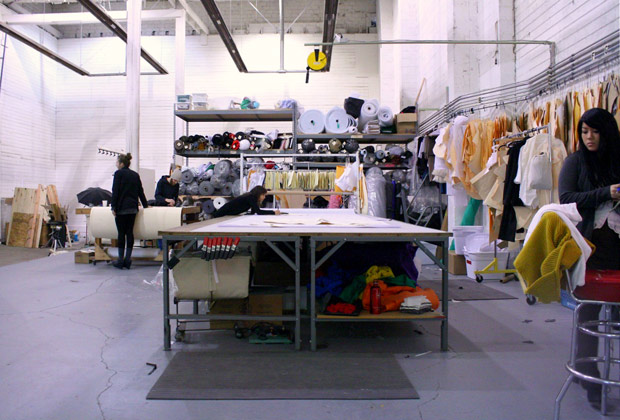
At what (x,y) coordinates should I click in order to perform the action: click on grey floor between white wall and table. Please return your answer as a coordinate pair (x, y). Looking at the image, I should click on (100, 315).